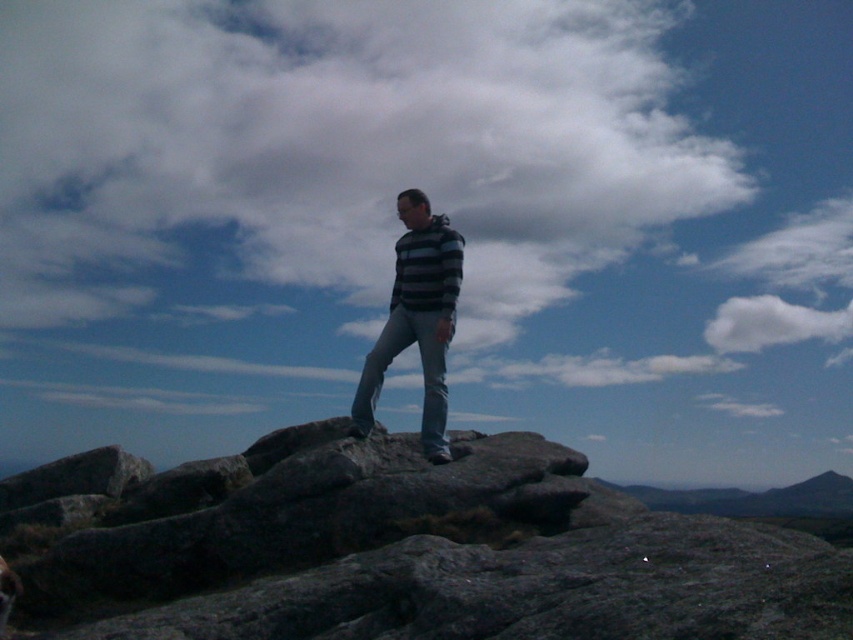
Which is more to the right, gray rock at center or striped fabric at center?

From the viewer's perspective, striped fabric at center appears more on the right side.

Does gray rock at center lie behind striped fabric at center?

No, gray rock at center is in front of striped fabric at center.

Measure the distance between gray rock at center and camera.

gray rock at center is 3.30 meters away from camera.

The width and height of the screenshot is (853, 640). What are the coordinates of `gray rock at center` in the screenshot? It's located at (404, 550).

Consider the image. Does denim at center have a greater height compared to gray rock formation at center?

Indeed, denim at center has a greater height compared to gray rock formation at center.

Is denim at center above gray rock formation at center?

Yes, denim at center is above gray rock formation at center.

Which is behind, point (412, 342) or point (683, 508)?

The point (683, 508) is behind.

This screenshot has height=640, width=853. In order to click on denim at center in this screenshot , I will do `click(421, 371)`.

Does white fluffy cloud at upper center have a smaller size compared to gray rock formation at center?

No, white fluffy cloud at upper center is not smaller than gray rock formation at center.

Does white fluffy cloud at upper center appear under gray rock formation at center?

Actually, white fluffy cloud at upper center is above gray rock formation at center.

Which is behind, point (302, 202) or point (795, 490)?

Point (302, 202)

Identify the location of white fluffy cloud at upper center. This screenshot has width=853, height=640. (334, 145).